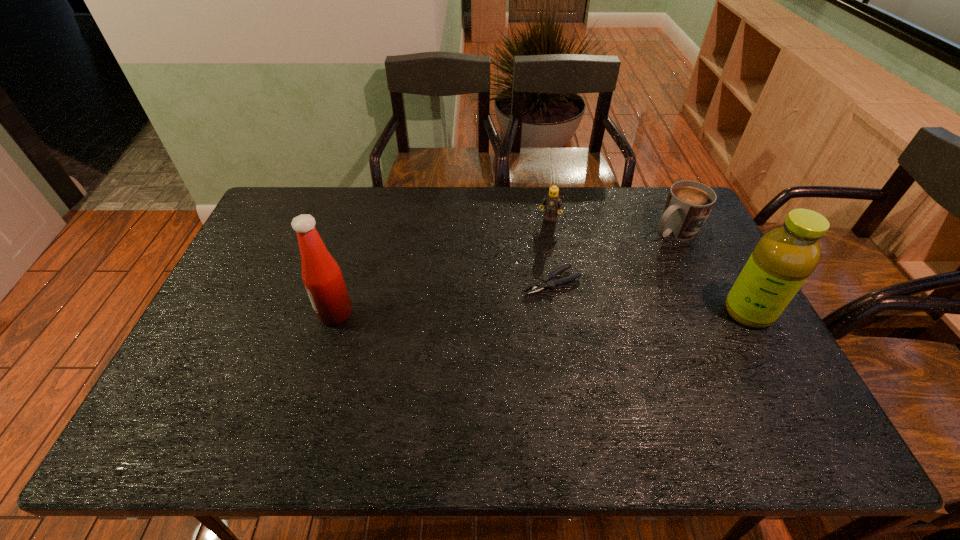
Where is `the leftmost object`? This screenshot has width=960, height=540. the leftmost object is located at coordinates click(x=322, y=277).

Find the location of `fruit juice`. fruit juice is located at coordinates (782, 260).

The image size is (960, 540). I want to click on mug, so click(689, 203).

Locate an element on the screen. Lego is located at coordinates (552, 202).

Image resolution: width=960 pixels, height=540 pixels. I want to click on pliers, so click(x=546, y=282).

The width and height of the screenshot is (960, 540). In order to click on free space located 0.210m on the front-facing side of the condiment in this screenshot , I will do `click(243, 314)`.

Where is `vacant point located on the front-facing side of the condiment`? Image resolution: width=960 pixels, height=540 pixels. vacant point located on the front-facing side of the condiment is located at coordinates (290, 314).

Where is `vacant space situated 0.170m on the front-facing side of the condiment`? Image resolution: width=960 pixels, height=540 pixels. vacant space situated 0.170m on the front-facing side of the condiment is located at coordinates (257, 314).

This screenshot has width=960, height=540. Identify the location of vacant space located on the side of the mug with the handle. (614, 266).

This screenshot has width=960, height=540. In order to click on vacant space located on the side of the mug with the handle in this screenshot , I will do `click(599, 275)`.